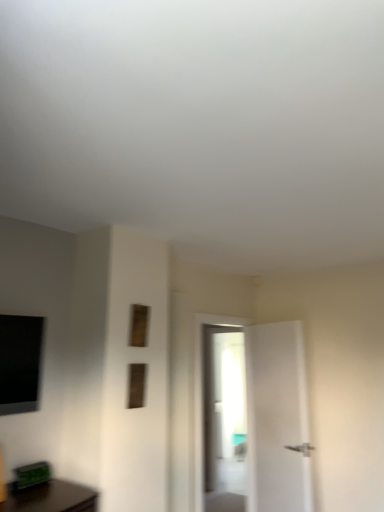
Question: Should I look upward or downward to see wooden frame at upper center, which ranks as the 2th window in bottom-to-top order?

Choices:
 (A) up
 (B) down

Answer: (B)

Question: Does wooden frame at center, the 2th window in the top-to-bottom sequence, have a larger size compared to wooden frame at upper center, which ranks as the 2th window in bottom-to-top order?

Choices:
 (A) yes
 (B) no

Answer: (A)

Question: Does wooden frame at center, the 2th window in the top-to-bottom sequence, appear on the left side of wooden frame at upper center, which is the first window from top to bottom?

Choices:
 (A) yes
 (B) no

Answer: (B)

Question: Is wooden frame at center, the 2th window in the top-to-bottom sequence, far from wooden frame at upper center, which ranks as the 2th window in bottom-to-top order?

Choices:
 (A) yes
 (B) no

Answer: (B)

Question: Does wooden frame at center, the 2th window in the top-to-bottom sequence, have a lesser height compared to wooden frame at upper center, which ranks as the 2th window in bottom-to-top order?

Choices:
 (A) yes
 (B) no

Answer: (B)

Question: Is wooden frame at upper center, which ranks as the 2th window in bottom-to-top order, completely or partially inside wooden frame at center, which appears as the 1th window when ordered from the bottom?

Choices:
 (A) yes
 (B) no

Answer: (B)

Question: Considering the relative sizes of wooden frame at center, the 2th window in the top-to-bottom sequence, and wooden frame at upper center, which is the first window from top to bottom, in the image provided, is wooden frame at center, the 2th window in the top-to-bottom sequence, taller than wooden frame at upper center, which is the first window from top to bottom,?

Choices:
 (A) yes
 (B) no

Answer: (A)

Question: Can you confirm if wooden frame at upper center, which ranks as the 2th window in bottom-to-top order, is wider than wooden frame at center, the 2th window in the top-to-bottom sequence?

Choices:
 (A) no
 (B) yes

Answer: (A)

Question: Is wooden frame at upper center, which is the first window from top to bottom, oriented towards wooden frame at center, which appears as the 1th window when ordered from the bottom?

Choices:
 (A) yes
 (B) no

Answer: (B)

Question: Is wooden frame at upper center, which is the first window from top to bottom, directly adjacent to wooden frame at center, the 2th window in the top-to-bottom sequence?

Choices:
 (A) yes
 (B) no

Answer: (B)

Question: Is wooden frame at upper center, which ranks as the 2th window in bottom-to-top order, turned away from wooden frame at center, the 2th window in the top-to-bottom sequence?

Choices:
 (A) yes
 (B) no

Answer: (B)

Question: Can you confirm if wooden frame at upper center, which is the first window from top to bottom, is taller than wooden frame at center, which appears as the 1th window when ordered from the bottom?

Choices:
 (A) no
 (B) yes

Answer: (A)

Question: Is wooden frame at upper center, which is the first window from top to bottom, bigger than wooden frame at center, the 2th window in the top-to-bottom sequence?

Choices:
 (A) yes
 (B) no

Answer: (B)

Question: From the image's perspective, is wooden frame at upper center, which ranks as the 2th window in bottom-to-top order, above or below wooden frame at center, which appears as the 1th window when ordered from the bottom?

Choices:
 (A) above
 (B) below

Answer: (A)